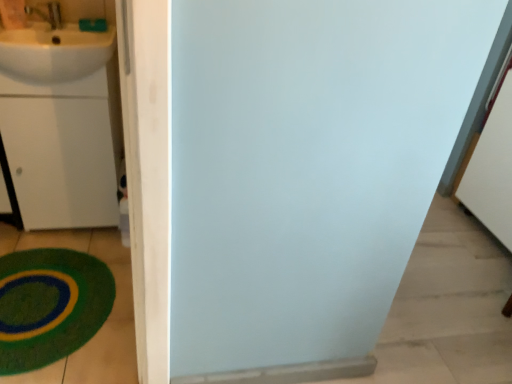
Question: From a real-world perspective, is green plush bath mat at lower left positioned above or below white glossy sink at upper left?

Choices:
 (A) below
 (B) above

Answer: (A)

Question: In the image, is green plush bath mat at lower left on the left side or the right side of white glossy sink at upper left?

Choices:
 (A) left
 (B) right

Answer: (A)

Question: Which object is the closest to the white glossy sink at upper left?

Choices:
 (A) green plush bath mat at lower left
 (B) white matte drawer at left

Answer: (B)

Question: Which is nearer to the white glossy sink at upper left?

Choices:
 (A) green plush bath mat at lower left
 (B) white matte drawer at left

Answer: (B)